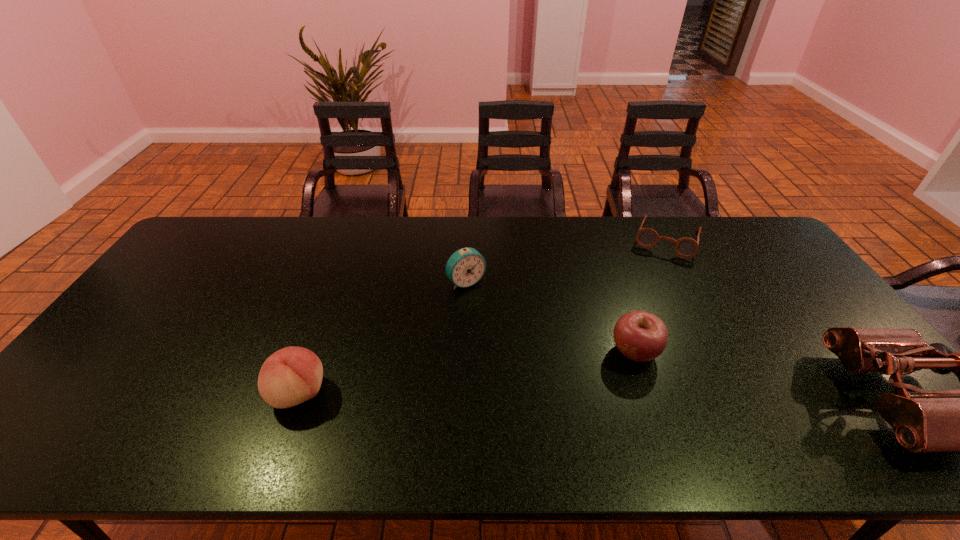
Locate an element on the screen. The width and height of the screenshot is (960, 540). vacant position located on the side of the third object from left to right with the unique marking is located at coordinates (531, 409).

The image size is (960, 540). What are the coordinates of `vacant region located on the side of the third object from left to right with the unique marking` in the screenshot? It's located at (548, 399).

The image size is (960, 540). In order to click on free region located on the side of the third object from left to right with the unique marking in this screenshot , I will do `click(552, 397)`.

Where is `blank area located on the front-facing side of the shortest object`? The width and height of the screenshot is (960, 540). blank area located on the front-facing side of the shortest object is located at coordinates (650, 298).

Locate an element on the screen. The width and height of the screenshot is (960, 540). free space located on the front-facing side of the shortest object is located at coordinates [648, 306].

Identify the location of vacant space located 0.310m on the front-facing side of the shortest object. (644, 320).

Identify the location of object present at the far edge. (685, 247).

At what (x,y) coordinates should I click in order to perform the action: click on object that is at the near edge. Please return your answer as a coordinate pair (x, y). Image resolution: width=960 pixels, height=540 pixels. Looking at the image, I should click on (290, 376).

Find the location of a particular element. vacant area at the far edge is located at coordinates (303, 241).

Locate an element on the screen. The width and height of the screenshot is (960, 540). free space at the near edge of the desktop is located at coordinates (803, 399).